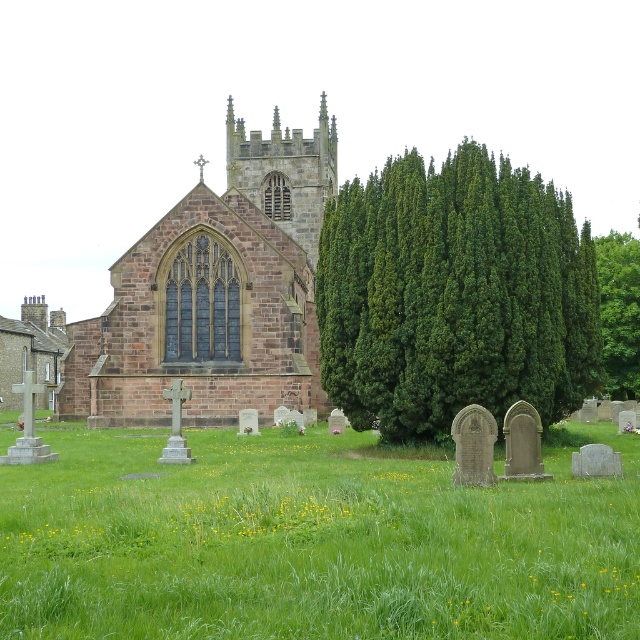
Question: Among these objects, which one is farthest from the camera?

Choices:
 (A) green grassy at center
 (B) green leafy tree at upper right

Answer: (B)

Question: In this image, where is green coniferous tree at center located relative to green leafy tree at upper right?

Choices:
 (A) right
 (B) left

Answer: (B)

Question: Estimate the real-world distances between objects in this image. Which object is closer to the brown stone church at center?

Choices:
 (A) green leafy tree at upper right
 (B) green coniferous tree at center
 (C) green grassy at center

Answer: (B)

Question: Is the position of brown stone church at center more distant than that of green leafy tree at upper right?

Choices:
 (A) yes
 (B) no

Answer: (A)

Question: Which of the following is the farthest from the observer?

Choices:
 (A) brown stone church at center
 (B) green coniferous tree at center
 (C) green grassy at center
 (D) green leafy tree at upper right

Answer: (A)

Question: Is green coniferous tree at center positioned before brown stone church at center?

Choices:
 (A) no
 (B) yes

Answer: (B)